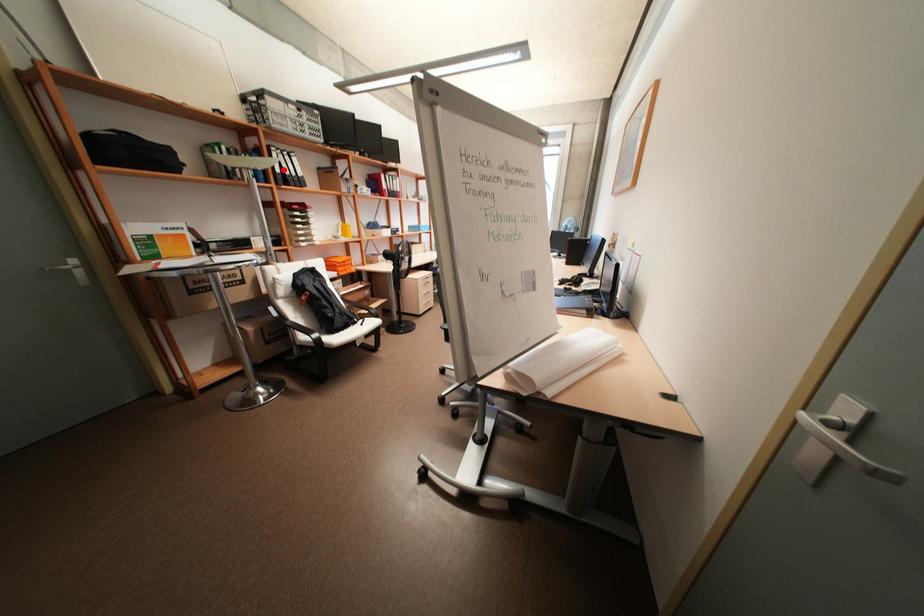
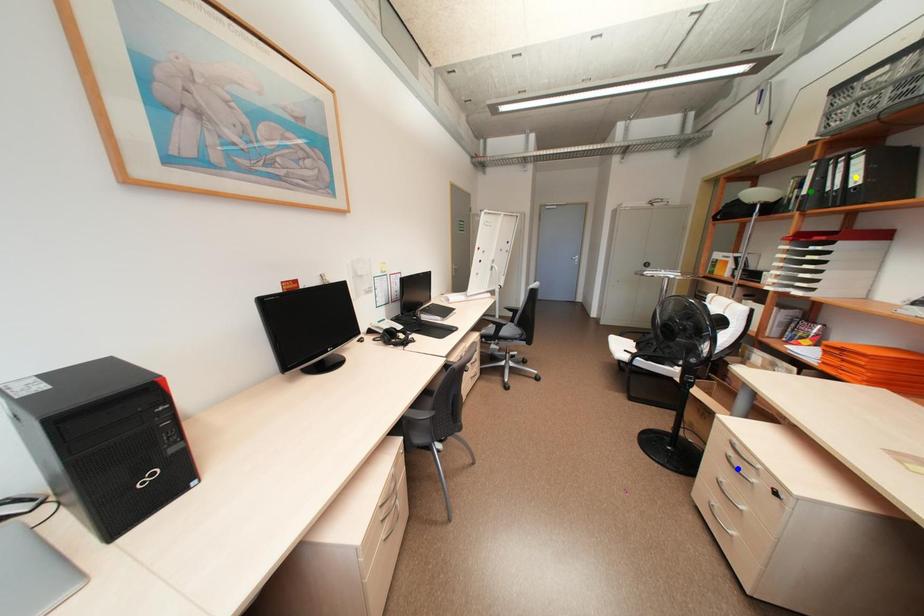
Question: I am providing you with two images of the same scene from different viewpoints. A red point is marked on the first image. You are given multiple points on the second image. Can you choose the point in image 2 that corresponds to the point in image 1?

Choices:
 (A) green point
 (B) blue point
 (C) yellow point

Answer: (A)